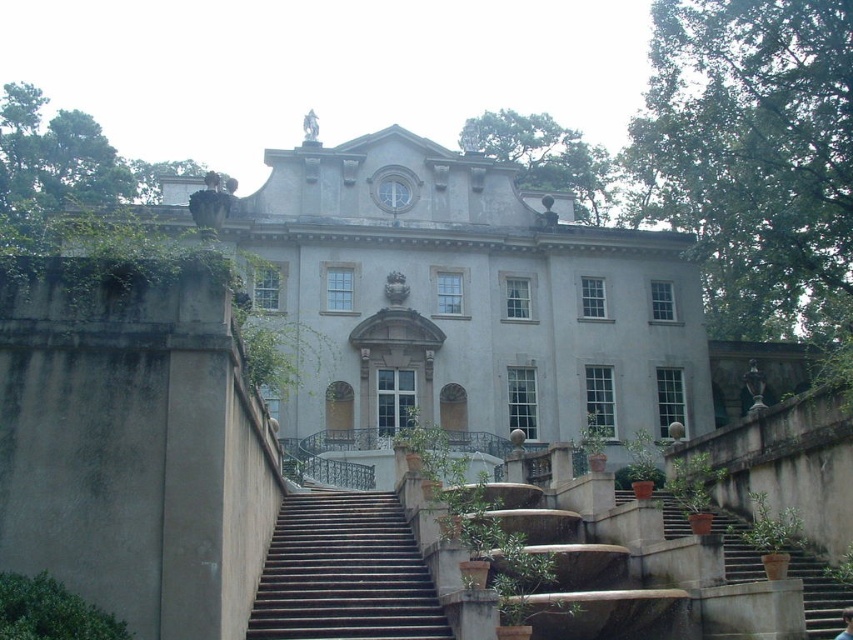
You are standing at the bottom of the dark brown stone stairs at center, looking up towards the white stone mansion at center. Which object is higher in elevation?

The white stone mansion at center is higher in elevation than the dark brown stone stairs at center because it is positioned above them.

You are a visitor approaching the grand classical building. You see the dark brown stone stairs at center and the brown concrete stairs at lower right. Which staircase should you take if you want to approach the building from the left side?

You should take the dark brown stone stairs at center because it is positioned to the left of the brown concrete stairs at lower right, aligning with your desired approach from the left side.

You are standing at the base of the staircase leading to the white stone mansion at center. If you want to take a photo of the mansion from the front, which direction should you face?

You should face the direction of the white stone mansion at center to take a photo of it from the front.